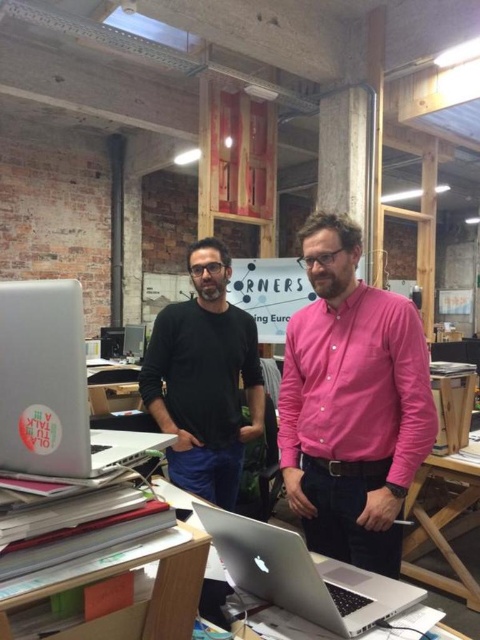
Question: Which object is the farthest from the pink cotton shirt at center?

Choices:
 (A) wooden table at center
 (B) silver metallic laptop at lower left
 (C) black matte shirt at center
 (D) silver metallic laptop at center

Answer: (A)

Question: Does silver metallic laptop at lower left appear on the right side of silver metallic laptop at center?

Choices:
 (A) yes
 (B) no

Answer: (B)

Question: Does black matte shirt at center have a larger size compared to wooden table at center?

Choices:
 (A) yes
 (B) no

Answer: (B)

Question: Does pink cotton shirt at center have a smaller size compared to wooden table at center?

Choices:
 (A) no
 (B) yes

Answer: (B)

Question: Which point is farther from the camera taking this photo?

Choices:
 (A) (93, 456)
 (B) (364, 516)
 (C) (468, 570)

Answer: (C)

Question: Estimate the real-world distances between objects in this image. Which object is closer to the wooden table at center?

Choices:
 (A) pink cotton shirt at center
 (B) black matte shirt at center

Answer: (B)